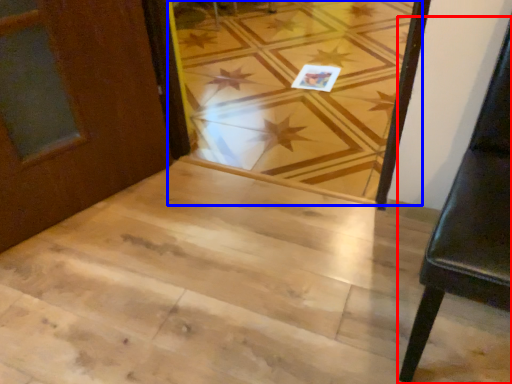
Question: Which point is further to the camera, furniture (highlighted by a red box) or plank (highlighted by a blue box)?

Choices:
 (A) furniture
 (B) plank

Answer: (B)